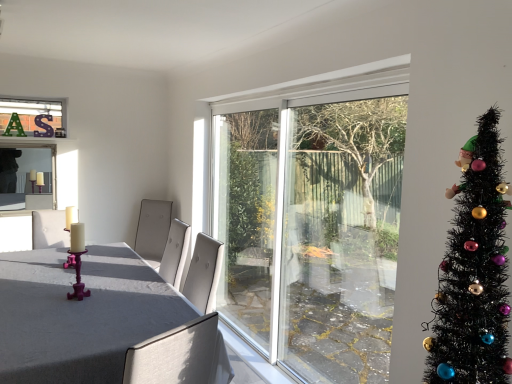
The width and height of the screenshot is (512, 384). What are the coordinates of `unoccupied space behind purple metallic candle holder at left` in the screenshot? It's located at (94, 286).